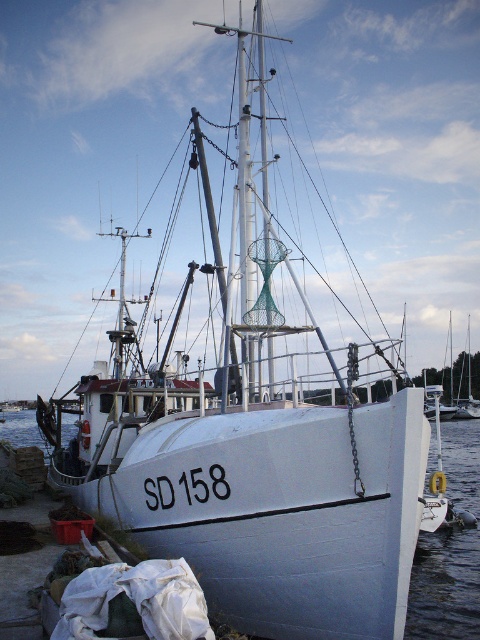
Question: Which of the following is the farthest from the observer?

Choices:
 (A) white smooth water at lower left
 (B) white matte boat at right

Answer: (B)

Question: Which of the following is the farthest from the observer?

Choices:
 (A) white smooth water at lower left
 (B) white matte boat at right

Answer: (B)

Question: Is white smooth water at lower left above white matte boat at right?

Choices:
 (A) no
 (B) yes

Answer: (A)

Question: Is white smooth water at lower left bigger than white matte boat at right?

Choices:
 (A) no
 (B) yes

Answer: (B)

Question: From the image, what is the correct spatial relationship of white smooth water at lower left in relation to white matte boat at right?

Choices:
 (A) above
 (B) below

Answer: (B)